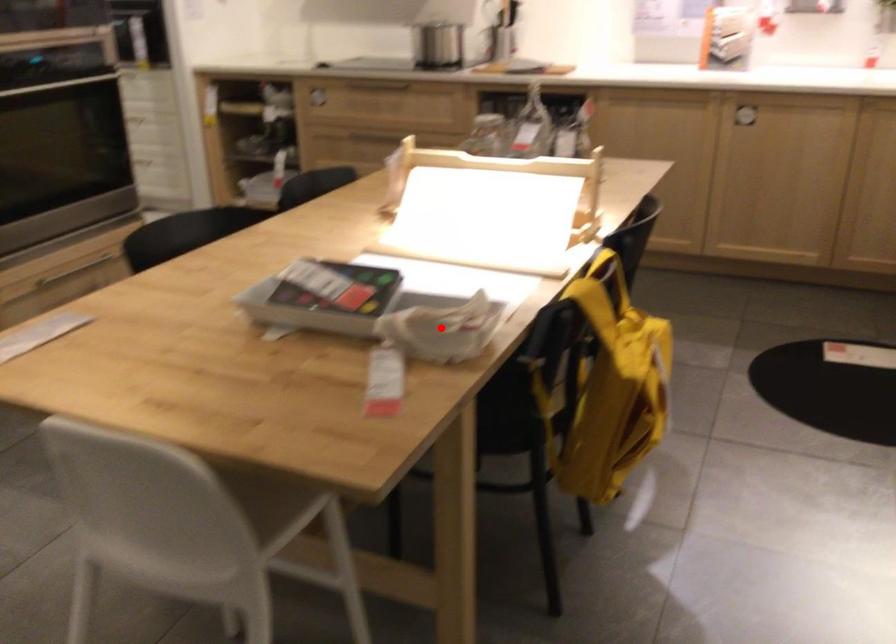
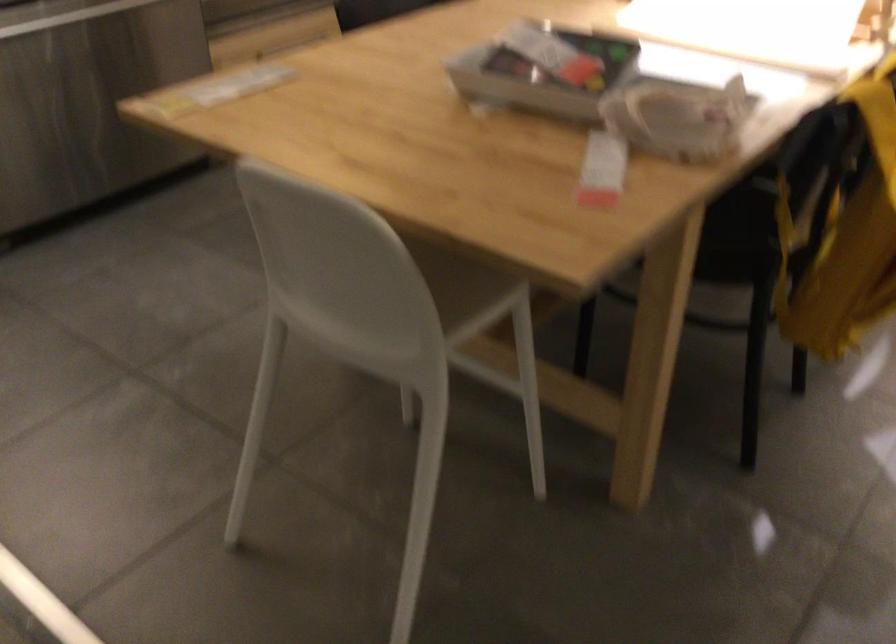
Question: I am providing you with two images of the same scene from different viewpoints. Image1 has a red point marked. In image2, the corresponding 3D location appears at what relative position? Reply with the corresponding letter.

Choices:
 (A) Closer
 (B) Farther

Answer: (A)